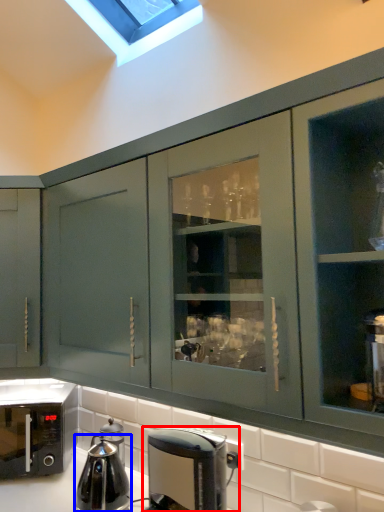
Question: Which object appears closest to the camera in this image, coffee maker (highlighted by a red box) or kitchen appliance (highlighted by a blue box)?

Choices:
 (A) coffee maker
 (B) kitchen appliance

Answer: (A)